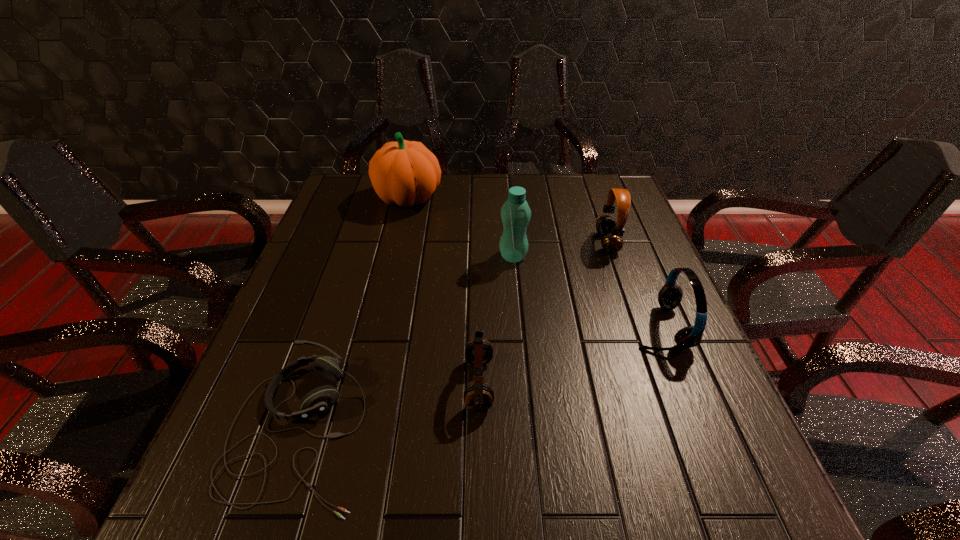
Where is `vacant space at the far edge of the desktop`? The width and height of the screenshot is (960, 540). vacant space at the far edge of the desktop is located at coordinates (463, 206).

The image size is (960, 540). What are the coordinates of `vacant space at the near edge of the desktop` in the screenshot? It's located at (580, 475).

Locate an element on the screen. The height and width of the screenshot is (540, 960). blank space at the left edge of the desktop is located at coordinates (357, 233).

At what (x,y) coordinates should I click in order to perform the action: click on free space at the right edge. Please return your answer as a coordinate pair (x, y). Image resolution: width=960 pixels, height=540 pixels. Looking at the image, I should click on (639, 220).

This screenshot has height=540, width=960. In the image, there is a desktop. In order to click on vacant space at the far left corner in this screenshot , I will do `click(346, 193)`.

This screenshot has width=960, height=540. I want to click on vacant area at the near left corner of the desktop, so click(250, 494).

The height and width of the screenshot is (540, 960). In the image, there is a desktop. What are the coordinates of `vacant region at the far right corner` in the screenshot? It's located at (597, 199).

The height and width of the screenshot is (540, 960). I want to click on vacant space at the near right corner, so click(x=744, y=474).

Where is `free area in between the farthest object and the bottle`? This screenshot has height=540, width=960. free area in between the farthest object and the bottle is located at coordinates (461, 227).

Image resolution: width=960 pixels, height=540 pixels. I want to click on vacant region between the shortest object and the pumpkin, so click(353, 314).